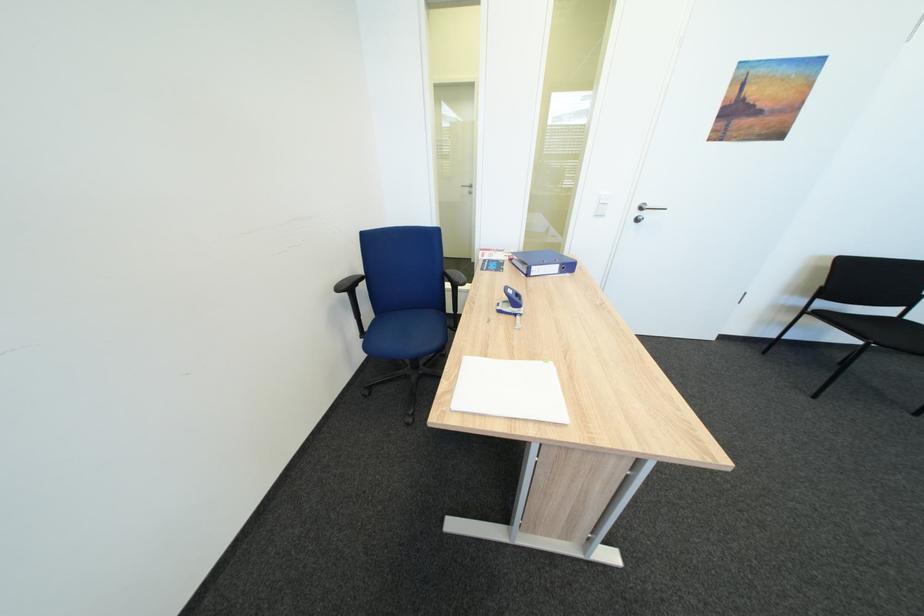
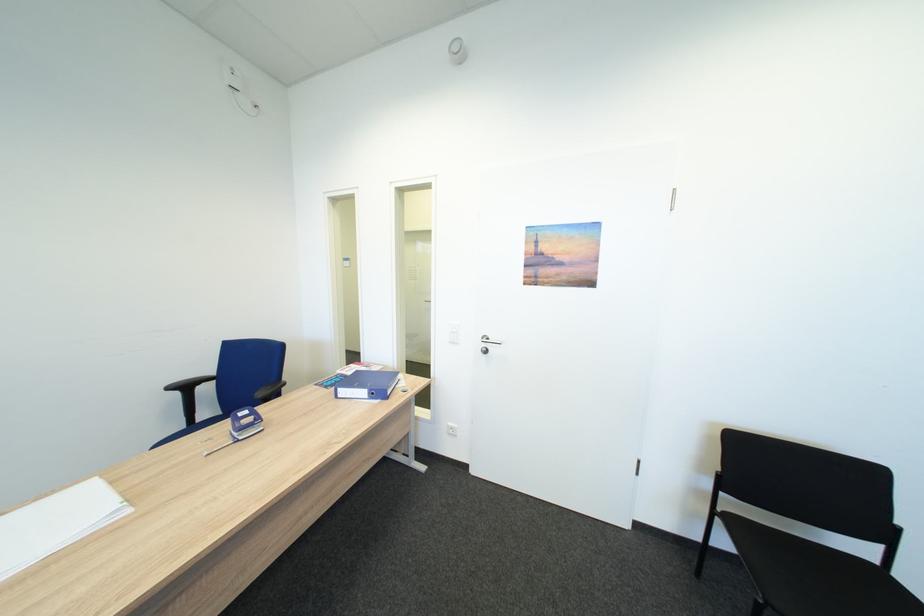
Question: What movement of the cameraman would produce the second image?

Choices:
 (A) Left
 (B) Right
 (C) Forward
 (D) Backward

Answer: (B)